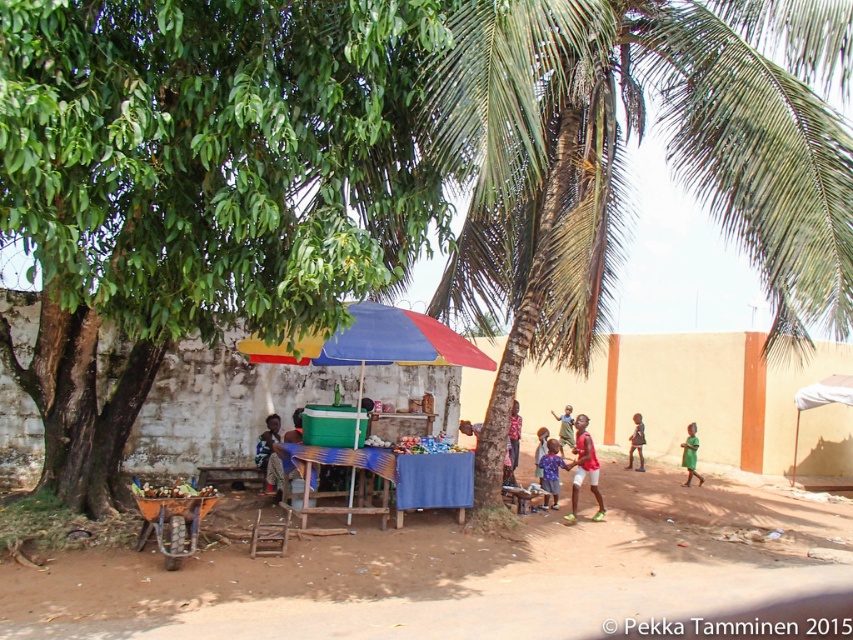
Is blue fabric umbrella at center positioned behind red fabric shirt at center?

No.

The width and height of the screenshot is (853, 640). What do you see at coordinates (376, 342) in the screenshot? I see `blue fabric umbrella at center` at bounding box center [376, 342].

Does point (383, 336) lie behind point (509, 451)?

That is False.

Locate an element on the screen. blue fabric umbrella at center is located at coordinates (376, 342).

Is point (309, 355) positioned behind point (556, 467)?

No, (309, 355) is in front of (556, 467).

Is blue fabric umbrella at center bigger than blue fabric shirt at center?

Yes, blue fabric umbrella at center is bigger than blue fabric shirt at center.

The image size is (853, 640). Describe the element at coordinates (376, 342) in the screenshot. I see `blue fabric umbrella at center` at that location.

Locate an element on the screen. blue fabric umbrella at center is located at coordinates (376, 342).

Describe the element at coordinates (550, 472) in the screenshot. This screenshot has height=640, width=853. I see `blue fabric shirt at center` at that location.

Is point (558, 452) more distant than point (637, 460)?

No, (558, 452) is closer to viewer.

The image size is (853, 640). In order to click on blue fabric shirt at center in this screenshot , I will do `click(550, 472)`.